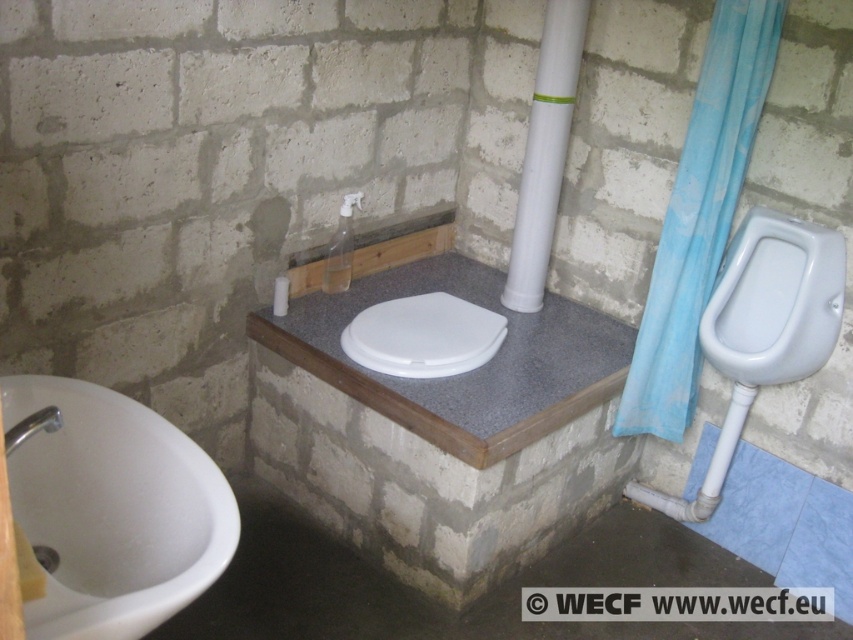
You are planning to place a new decorative item in the bathroom. The item is 1 meter wide. You see the blue fabric curtain at right and the white plastic pipe at center. Which object can the decorative item fit next to without overlapping?

The decorative item that is 1 meter wide can fit next to the blue fabric curtain at right because it is larger than the white plastic pipe at center, providing more space.

You are a maintenance worker checking the bathroom layout. You need to access the white plastic pipe at center for repairs. Is the blue fabric curtain at right blocking your direct path to it?

The blue fabric curtain at right is closer to the viewer than the white plastic pipe at center, so it is blocking the direct path to the white plastic pipe at center.